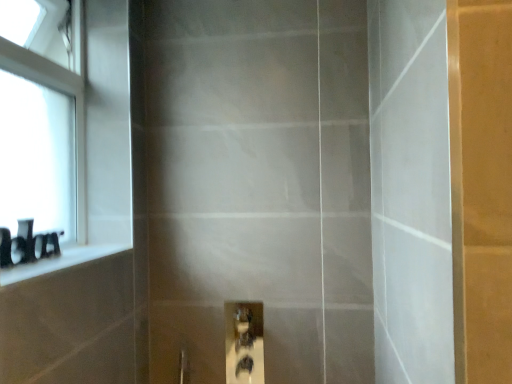
This screenshot has width=512, height=384. Describe the element at coordinates (91, 131) in the screenshot. I see `white glass window at upper left` at that location.

Consider the image. In order to face black matte toiletries at left, should I rotate leftwards or rightwards?

You should look left and rotate roughly 29.470 degrees.

The width and height of the screenshot is (512, 384). What do you see at coordinates (59, 262) in the screenshot? I see `black glossy ledge at left` at bounding box center [59, 262].

This screenshot has width=512, height=384. What are the coordinates of `white glass window at upper left` in the screenshot? It's located at (91, 131).

Would you consider white glass window at upper left to be distant from matte glass screen door at center?

No, white glass window at upper left is not far from matte glass screen door at center.

Based on their sizes in the image, would you say white glass window at upper left is bigger or smaller than matte glass screen door at center?

Considering their sizes, white glass window at upper left takes up less space than matte glass screen door at center.

From the image's perspective, is white glass window at upper left on top of matte glass screen door at center?

Correct, white glass window at upper left appears higher than matte glass screen door at center in the image.

Is point (90, 148) farther from camera compared to point (170, 304)?

That is False.

From a real-world perspective, is black matte toiletries at left on black glossy ledge at left?

Yes.

How different are the orientations of black matte toiletries at left and black glossy ledge at left in degrees?

There is a 0.247-degree angle between the facing directions of black matte toiletries at left and black glossy ledge at left.

Does black matte toiletries at left turn towards black glossy ledge at left?

Yes, black matte toiletries at left is facing black glossy ledge at left.

Would you say black matte toiletries at left is to the left or to the right of black glossy ledge at left in the picture?

In the image, black matte toiletries at left appears on the left side of black glossy ledge at left.

From a real-world perspective, who is located higher, white glass window at upper left or black matte toiletries at left?

In real-world perspective, white glass window at upper left is above.

Is white glass window at upper left next to black matte toiletries at left and touching it?

white glass window at upper left and black matte toiletries at left are not in contact.

Based on the photo, between white glass window at upper left and black matte toiletries at left, which one has less height?

black matte toiletries at left is shorter.

From the image's perspective, is white glass window at upper left above or below black matte toiletries at left?

From the image's perspective, white glass window at upper left appears above black matte toiletries at left.

Considering the points (29, 237) and (292, 184), which point is behind, point (29, 237) or point (292, 184)?

The point (292, 184) is farther from the camera.

How many degrees apart are the facing directions of black matte toiletries at left and matte glass screen door at center?

90.6 degrees.

Is black matte toiletries at left not close to matte glass screen door at center?

No, black matte toiletries at left is in close proximity to matte glass screen door at center.

Is black matte toiletries at left facing towards matte glass screen door at center?

Yes, black matte toiletries at left faces towards matte glass screen door at center.

From the image's perspective, between black glossy ledge at left and white glass window at upper left, which one is located above?

white glass window at upper left, from the image's perspective.

How many degrees apart are the facing directions of black glossy ledge at left and white glass window at upper left?

The angle between the facing direction of black glossy ledge at left and the facing direction of white glass window at upper left is 0.671 degrees.

Where is `window behind the black glossy ledge at left`? The width and height of the screenshot is (512, 384). window behind the black glossy ledge at left is located at coordinates (91, 131).

Which of these two, black glossy ledge at left or white glass window at upper left, is bigger?

Result: white glass window at upper left.

Which is behind, point (184, 147) or point (7, 232)?

Positioned behind is point (184, 147).

From the image's perspective, does matte glass screen door at center appear lower than black matte toiletries at left?

Actually, matte glass screen door at center appears above black matte toiletries at left in the image.

Considering the sizes of objects matte glass screen door at center and black matte toiletries at left in the image provided, who is wider, matte glass screen door at center or black matte toiletries at left?

matte glass screen door at center is wider.

Is black glossy ledge at left turned away from matte glass screen door at center?

No, black glossy ledge at left is not facing away from matte glass screen door at center.

From the image's perspective, is black glossy ledge at left over matte glass screen door at center?

No.

Which is farther from the camera, (46, 264) or (365, 19)?

Positioned behind is point (365, 19).

Measure the distance between black glossy ledge at left and matte glass screen door at center.

black glossy ledge at left and matte glass screen door at center are 22.02 inches apart from each other.

The height and width of the screenshot is (384, 512). Identify the location of screen door in front of the white glass window at upper left. (x=260, y=184).

Locate an element on the screen. toiletry that appears on the left of black glossy ledge at left is located at coordinates (27, 244).

From the image, which object appears to be farther from matte glass screen door at center, black glossy ledge at left or white glass window at upper left?

black glossy ledge at left is further to matte glass screen door at center.

Estimate the real-world distances between objects in this image. Which object is closer to black matte toiletries at left, white glass window at upper left or black glossy ledge at left?

Among the two, black glossy ledge at left is located nearer to black matte toiletries at left.

Which object lies nearer to the anchor point black glossy ledge at left, white glass window at upper left or black matte toiletries at left?

black matte toiletries at left lies closer to black glossy ledge at left than the other object.

When comparing their distances from white glass window at upper left, does black matte toiletries at left or black glossy ledge at left seem closer?

The object closer to white glass window at upper left is black glossy ledge at left.

From the image, which object appears to be nearer to black glossy ledge at left, white glass window at upper left or matte glass screen door at center?

white glass window at upper left is closer to black glossy ledge at left.

Based on their spatial positions, is black matte toiletries at left or white glass window at upper left closer to black glossy ledge at left?

black matte toiletries at left is positioned closer to the anchor black glossy ledge at left.

Estimate the real-world distances between objects in this image. Which object is closer to matte glass screen door at center, black glossy ledge at left or black matte toiletries at left?

The object closer to matte glass screen door at center is black glossy ledge at left.

Based on their spatial positions, is matte glass screen door at center or white glass window at upper left closer to black matte toiletries at left?

white glass window at upper left lies closer to black matte toiletries at left than the other object.

Where is `toiletry that lies between white glass window at upper left and black glossy ledge at left from top to bottom`? The height and width of the screenshot is (384, 512). toiletry that lies between white glass window at upper left and black glossy ledge at left from top to bottom is located at coordinates (27, 244).

Find the location of `ledge situated between black matte toiletries at left and matte glass screen door at center from left to right`. ledge situated between black matte toiletries at left and matte glass screen door at center from left to right is located at coordinates (59, 262).

Identify the location of ledge situated between white glass window at upper left and matte glass screen door at center from left to right. The width and height of the screenshot is (512, 384). (59, 262).

This screenshot has width=512, height=384. In order to click on toiletry situated between white glass window at upper left and matte glass screen door at center from left to right in this screenshot , I will do `click(27, 244)`.